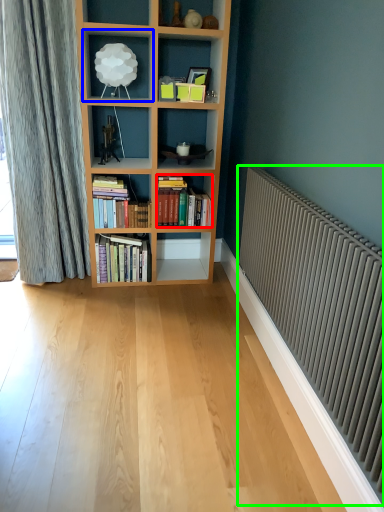
Question: Considering the real-world distances, which object is farthest from book (highlighted by a red box)? shelf (highlighted by a blue box) or radiator (highlighted by a green box)?

Choices:
 (A) shelf
 (B) radiator

Answer: (B)